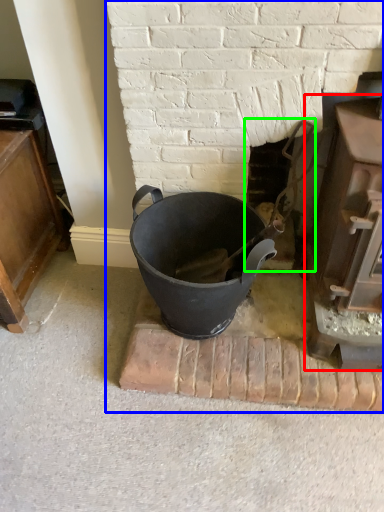
Question: Which is nearer to the fireplace (highlighted by a red box)? fireplace (highlighted by a blue box) or fireplace (highlighted by a green box).

Choices:
 (A) fireplace
 (B) fireplace

Answer: (B)